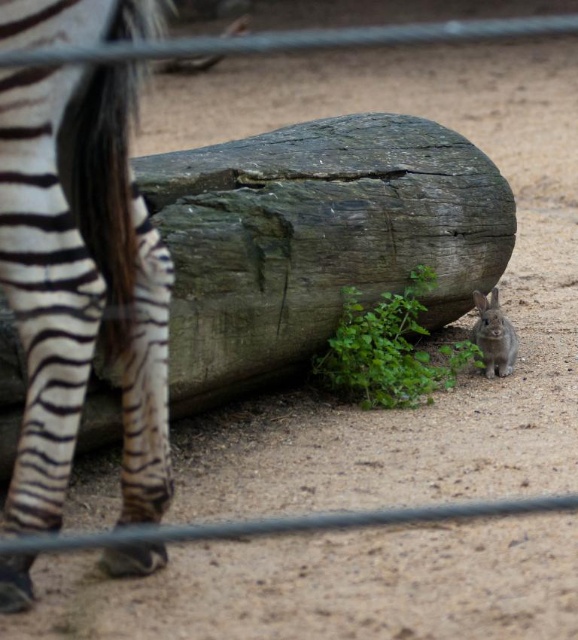
Who is taller, black and white striped zebra at left or gray furry rabbit at lower right?

black and white striped zebra at left is taller.

In the scene shown: Does black and white striped zebra at left lie in front of gray furry rabbit at lower right?

That is True.

The width and height of the screenshot is (578, 640). I want to click on black and white striped zebra at left, so coord(80,282).

Can you confirm if black and white striped zebra at left is positioned below green leafy plant at lower right?

Actually, black and white striped zebra at left is above green leafy plant at lower right.

At what (x,y) coordinates should I click in order to perform the action: click on black and white striped zebra at left. Please return your answer as a coordinate pair (x, y). The height and width of the screenshot is (640, 578). Looking at the image, I should click on (80, 282).

Image resolution: width=578 pixels, height=640 pixels. Describe the element at coordinates (80, 282) in the screenshot. I see `black and white striped zebra at left` at that location.

Locate an element on the screen. black and white striped zebra at left is located at coordinates (80, 282).

Is green leafy plant at lower right smaller than gray furry rabbit at lower right?

Incorrect, green leafy plant at lower right is not smaller in size than gray furry rabbit at lower right.

Describe the element at coordinates (388, 349) in the screenshot. I see `green leafy plant at lower right` at that location.

This screenshot has height=640, width=578. I want to click on green leafy plant at lower right, so click(388, 349).